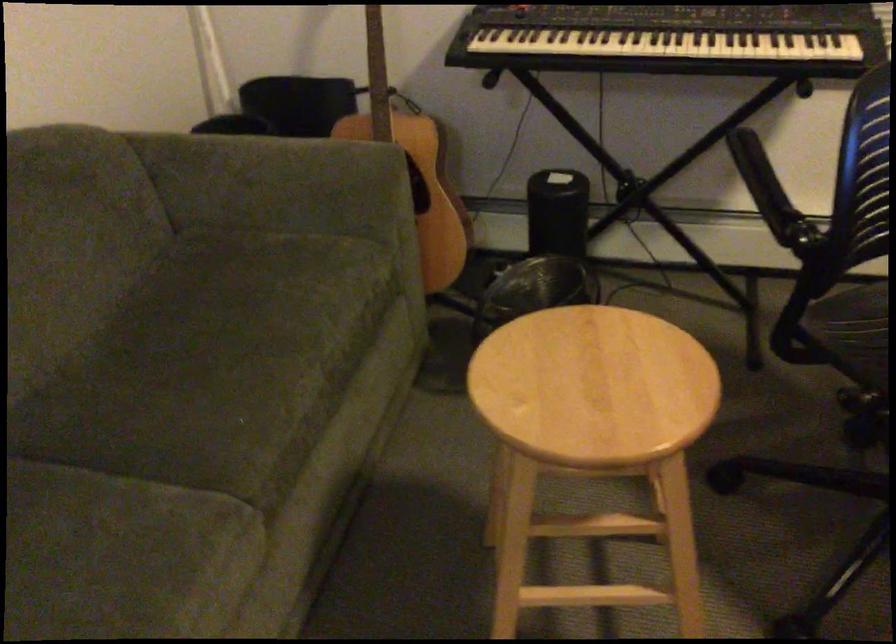
Locate an element on the screen. The width and height of the screenshot is (896, 644). wooden stool surface is located at coordinates (593, 386).